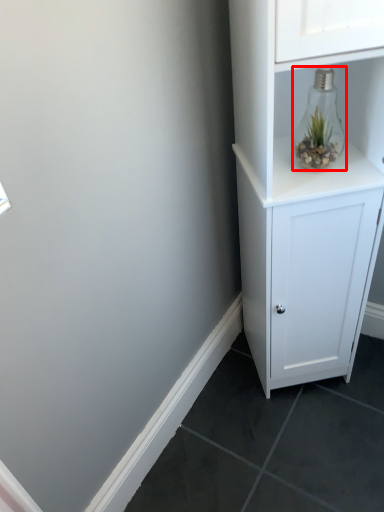
Question: Considering the relative positions of glass vase (annotated by the red box) and cupboard in the image provided, where is glass vase (annotated by the red box) located with respect to the staircase?

Choices:
 (A) left
 (B) right

Answer: (A)